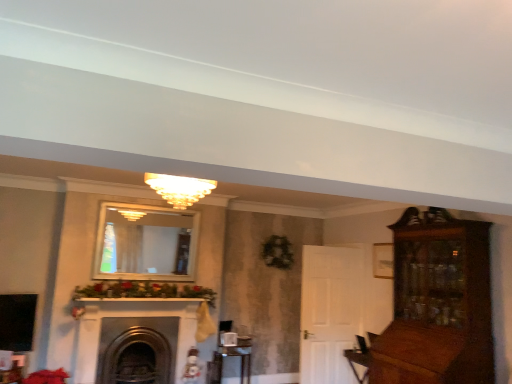
Locate an element on the screen. The image size is (512, 384). metallic silver table at lower center is located at coordinates (234, 356).

The height and width of the screenshot is (384, 512). Describe the element at coordinates (234, 356) in the screenshot. I see `metallic silver table at lower center` at that location.

This screenshot has width=512, height=384. What do you see at coordinates (179, 188) in the screenshot?
I see `matte glass chandelier at center` at bounding box center [179, 188].

Locate an element on the screen. The height and width of the screenshot is (384, 512). metallic silver table at lower center is located at coordinates (234, 356).

Could you tell me if dark gray stone fireplace at center is facing metallic silver table at lower center?

No.

Which of these two, dark gray stone fireplace at center or metallic silver table at lower center, is wider?

Wider between the two is dark gray stone fireplace at center.

Considering the sizes of dark gray stone fireplace at center and metallic silver table at lower center in the image, is dark gray stone fireplace at center taller or shorter than metallic silver table at lower center?

Clearly, dark gray stone fireplace at center is taller compared to metallic silver table at lower center.

How many degrees apart are the facing directions of dark gray stone fireplace at center and metallic silver table at lower center?

0.293 degrees separate the facing orientations of dark gray stone fireplace at center and metallic silver table at lower center.

From a real-world perspective, is matte glass chandelier at center on metallic silver table at lower center?

Yes, from a real-world perspective, matte glass chandelier at center is on top of metallic silver table at lower center.

Between matte glass chandelier at center and metallic silver table at lower center, which one appears on the right side from the viewer's perspective?

From the viewer's perspective, metallic silver table at lower center appears more on the right side.

Is matte glass chandelier at center outside of metallic silver table at lower center?

That's correct, matte glass chandelier at center is outside of metallic silver table at lower center.

Between dark gray stone fireplace at center and matte glass chandelier at center, which one has larger size?

Bigger between the two is dark gray stone fireplace at center.

Is there a large distance between dark gray stone fireplace at center and matte glass chandelier at center?

dark gray stone fireplace at center is positioned a significant distance from matte glass chandelier at center.

Between dark gray stone fireplace at center and matte glass chandelier at center, which one has more height?

With more height is dark gray stone fireplace at center.

How much distance is there between dark gray stone fireplace at center and matte glass chandelier at center?

dark gray stone fireplace at center is 6.63 feet away from matte glass chandelier at center.

Which object is wider, metallic silver table at lower center or matte glass chandelier at center?

With larger width is matte glass chandelier at center.

From a real-world perspective, relative to matte glass chandelier at center, is metallic silver table at lower center vertically above or below?

From a real-world perspective, metallic silver table at lower center is physically below matte glass chandelier at center.

Is metallic silver table at lower center outside of matte glass chandelier at center?

Yes.

Measure the distance from metallic silver table at lower center to dark gray stone fireplace at center.

36.90 inches.

Is metallic silver table at lower center closer to the viewer compared to dark gray stone fireplace at center?

No, metallic silver table at lower center is further to the viewer.

I want to click on table below the dark gray stone fireplace at center (from the image's perspective), so click(x=234, y=356).

Does metallic silver table at lower center have a greater height compared to dark gray stone fireplace at center?

Incorrect, the height of metallic silver table at lower center is not larger of that of dark gray stone fireplace at center.

Is matte glass chandelier at center facing away from dark gray stone fireplace at center?

No.

Can dark gray stone fireplace at center be found inside matte glass chandelier at center?

No, dark gray stone fireplace at center is not surrounded by matte glass chandelier at center.

Considering the relative sizes of matte glass chandelier at center and dark gray stone fireplace at center in the image provided, is matte glass chandelier at center wider than dark gray stone fireplace at center?

Correct, the width of matte glass chandelier at center exceeds that of dark gray stone fireplace at center.

In order to click on table below the dark gray stone fireplace at center (from the image's perspective) in this screenshot , I will do `click(234, 356)`.

Identify the location of table located behind the matte glass chandelier at center. (234, 356).

Estimate the real-world distances between objects in this image. Which object is further from matte glass chandelier at center, dark gray stone fireplace at center or metallic silver table at lower center?

metallic silver table at lower center is positioned further to the anchor matte glass chandelier at center.

In the scene shown: Looking at the image, which one is located closer to matte glass chandelier at center, metallic silver table at lower center or dark gray stone fireplace at center?

Based on the image, dark gray stone fireplace at center appears to be nearer to matte glass chandelier at center.

From the image, which object appears to be farther from dark gray stone fireplace at center, matte glass chandelier at center or metallic silver table at lower center?

Among the two, matte glass chandelier at center is located further to dark gray stone fireplace at center.

Considering their positions, is matte glass chandelier at center positioned further to metallic silver table at lower center than dark gray stone fireplace at center?

Among the two, matte glass chandelier at center is located further to metallic silver table at lower center.

Which object lies nearer to the anchor point metallic silver table at lower center, dark gray stone fireplace at center or matte glass chandelier at center?

The object closer to metallic silver table at lower center is dark gray stone fireplace at center.

Which object lies further to the anchor point dark gray stone fireplace at center, metallic silver table at lower center or matte glass chandelier at center?

matte glass chandelier at center.

This screenshot has width=512, height=384. Identify the location of fireplace between matte glass chandelier at center and metallic silver table at lower center in the vertical direction. (137, 350).